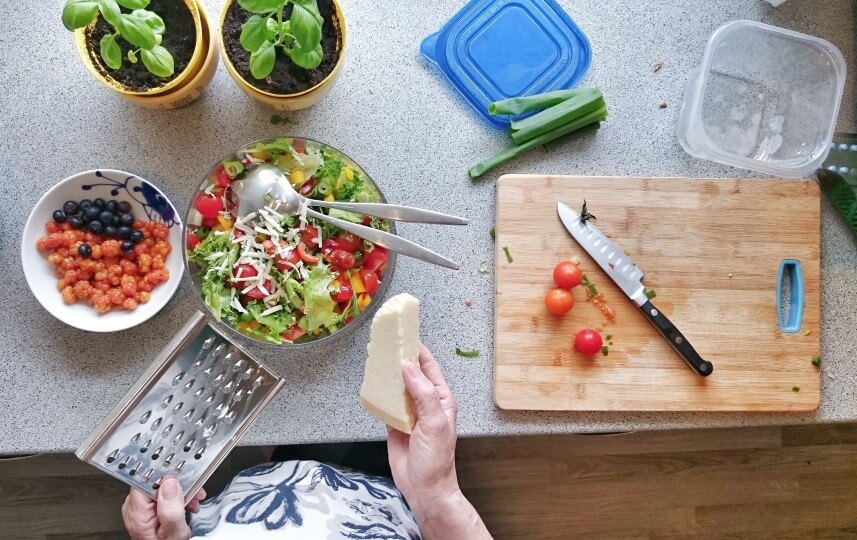
I want to click on food storage container, so click(x=508, y=47), click(x=736, y=108).